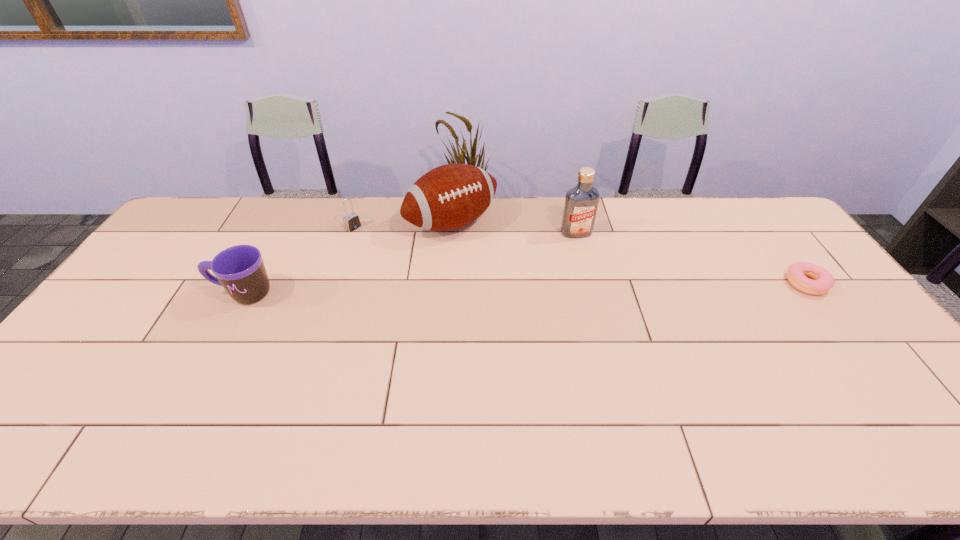
Locate an element on the screen. The image size is (960, 540). free location located 0.180m on the laces of the football is located at coordinates (506, 274).

At what (x,y) coordinates should I click in order to perform the action: click on free space located 0.390m on the laces of the football. Please return your answer as a coordinate pair (x, y). The width and height of the screenshot is (960, 540). Looking at the image, I should click on (549, 318).

In order to click on vacant space located on the laces of the football in this screenshot , I will do `click(519, 288)`.

Find the location of a particular element. This screenshot has height=540, width=960. vacant region located 0.240m on the front-facing side of the vodka is located at coordinates (602, 290).

Identify the location of vacant space situated 0.390m on the front-facing side of the vodka. (618, 329).

The width and height of the screenshot is (960, 540). I want to click on vacant region located 0.140m on the front-facing side of the vodka, so click(591, 267).

Locate an element on the screen. vacant point located on the shackle of the second object from left to right is located at coordinates (393, 254).

Where is `vacant area situated on the shackle of the second object from left to right`? The image size is (960, 540). vacant area situated on the shackle of the second object from left to right is located at coordinates (371, 239).

You are a GUI agent. You are given a task and a screenshot of the screen. Output one action in this format:
    pyautogui.click(x=<x>, y=<y>)
    Task: Click on the vacant point located 0.180m on the shackle of the second object from left to right
    The height and width of the screenshot is (540, 960).
    Given the screenshot: What is the action you would take?
    pyautogui.click(x=393, y=254)

I want to click on football located at the far edge, so click(x=449, y=197).